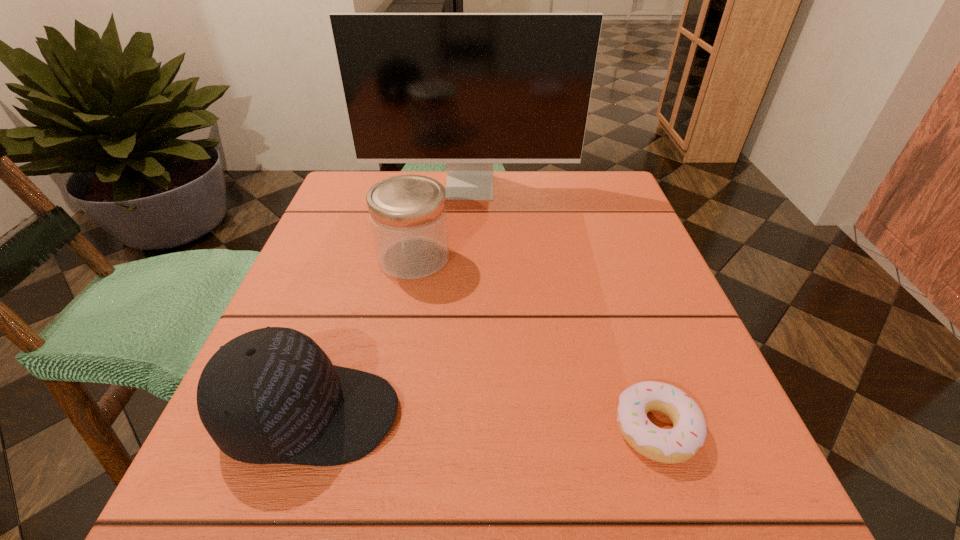
I want to click on free spot that satisfies the following two spatial constraints: 1. at the front of the shortest object where the brim is located; 2. on the left side of the baseball cap, so click(x=307, y=428).

The image size is (960, 540). In order to click on free space that satisfies the following two spatial constraints: 1. on the back side of the doughnut; 2. at the front of the baseball cap where the brim is located in this screenshot , I will do `click(652, 415)`.

I want to click on free space that satisfies the following two spatial constraints: 1. at the front of the doughnut where the brim is located; 2. on the left side of the baseball cap, so click(x=307, y=428).

The height and width of the screenshot is (540, 960). I want to click on vacant area that satisfies the following two spatial constraints: 1. on the front-facing side of the tallest object; 2. at the front of the baseball cap where the brim is located, so click(461, 415).